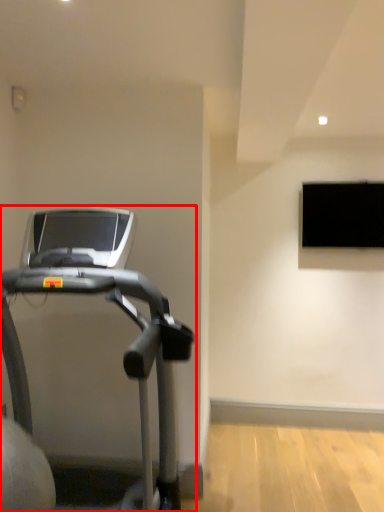
Question: In this image, where is treadmill (annotated by the red box) located relative to window?

Choices:
 (A) right
 (B) left

Answer: (B)